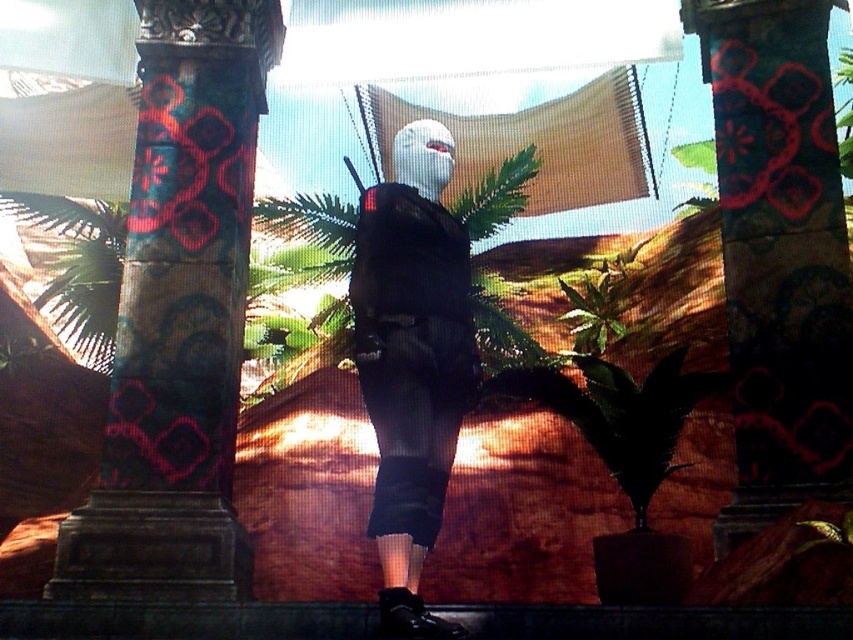
Question: Estimate the real-world distances between objects in this image. Which object is farther from the carved stone column at left?

Choices:
 (A) matte black backpack at center
 (B) carved stone column at center

Answer: (B)

Question: Which of the following is the closest to the observer?

Choices:
 (A) (786, 35)
 (B) (386, 346)

Answer: (B)

Question: Does carved stone column at left have a smaller size compared to carved stone column at center?

Choices:
 (A) no
 (B) yes

Answer: (B)

Question: Which point is closer to the camera taking this photo?

Choices:
 (A) (381, 618)
 (B) (215, 518)
 (C) (820, 323)

Answer: (A)

Question: Is carved stone column at left positioned before carved stone column at center?

Choices:
 (A) yes
 (B) no

Answer: (A)

Question: Does carved stone column at left appear on the right side of carved stone column at center?

Choices:
 (A) no
 (B) yes

Answer: (A)